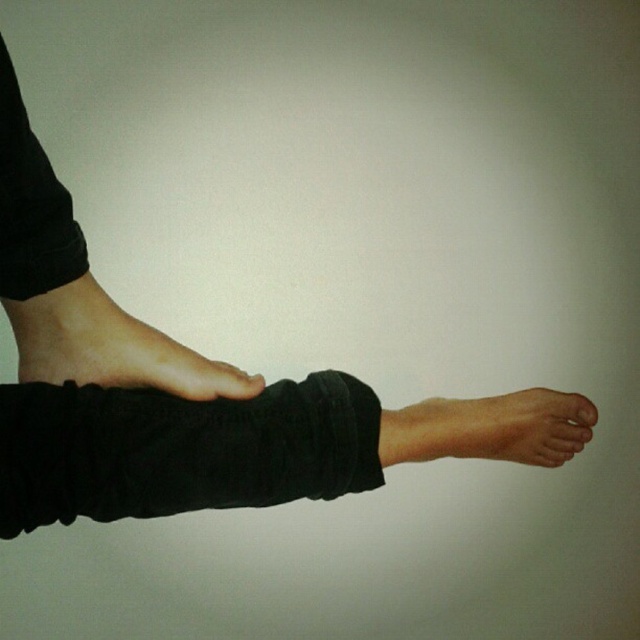
Who is shorter, black cotton leg at center or black matte leg at left?

black cotton leg at center is shorter.

Which is more to the left, black cotton leg at center or black matte leg at left?

black matte leg at left is more to the left.

Who is more distant from viewer, (195, 497) or (168, 348)?

The point (168, 348) is behind.

Where is `black cotton leg at center`? The width and height of the screenshot is (640, 640). black cotton leg at center is located at coordinates (248, 444).

Can you confirm if black cotton leg at center is smaller than smooth skin foot at lower left?

No.

Can you confirm if black cotton leg at center is bigger than smooth skin foot at lower left?

Yes.

Find the location of a particular element. black cotton leg at center is located at coordinates (248, 444).

The height and width of the screenshot is (640, 640). In order to click on black cotton leg at center in this screenshot , I will do `click(248, 444)`.

Based on the photo, is smooth skin foot at lower left bigger than skinny flesh at lower right?

Actually, smooth skin foot at lower left might be smaller than skinny flesh at lower right.

Which is in front, point (52, 292) or point (493, 436)?

Point (52, 292)

Who is more distant from viewer, [32,333] or [438,433]?

Point [438,433]

Image resolution: width=640 pixels, height=640 pixels. Identify the location of smooth skin foot at lower left. (112, 348).